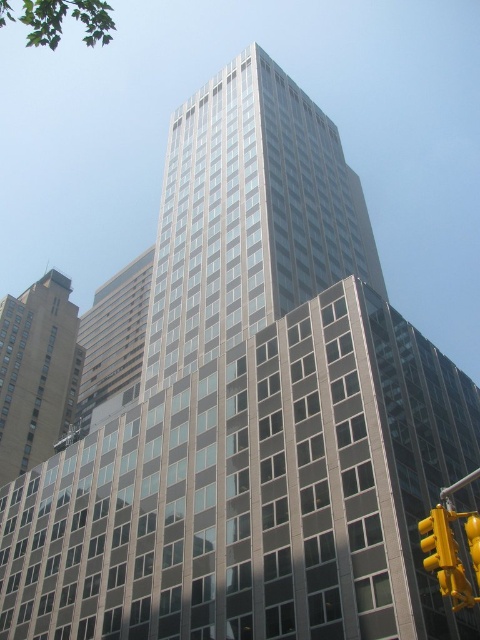
Question: Does beige stone building at left appear on the left side of yellow plastic traffic light at lower right?

Choices:
 (A) no
 (B) yes

Answer: (B)

Question: Is beige stone building at left positioned at the back of yellow metallic traffic light at lower right?

Choices:
 (A) no
 (B) yes

Answer: (B)

Question: Which object appears closest to the camera in this image?

Choices:
 (A) yellow metallic traffic light at lower right
 (B) yellow plastic traffic light at lower right
 (C) beige stone building at left

Answer: (A)

Question: Which of the following is the farthest from the observer?

Choices:
 (A) yellow plastic traffic light at lower right
 (B) yellow metallic traffic light at lower right
 (C) beige stone building at left

Answer: (C)

Question: Which point is farther from the camera taking this photo?

Choices:
 (A) (23, 323)
 (B) (432, 536)

Answer: (A)

Question: Can you confirm if beige stone building at left is wider than yellow metallic traffic light at lower right?

Choices:
 (A) yes
 (B) no

Answer: (A)